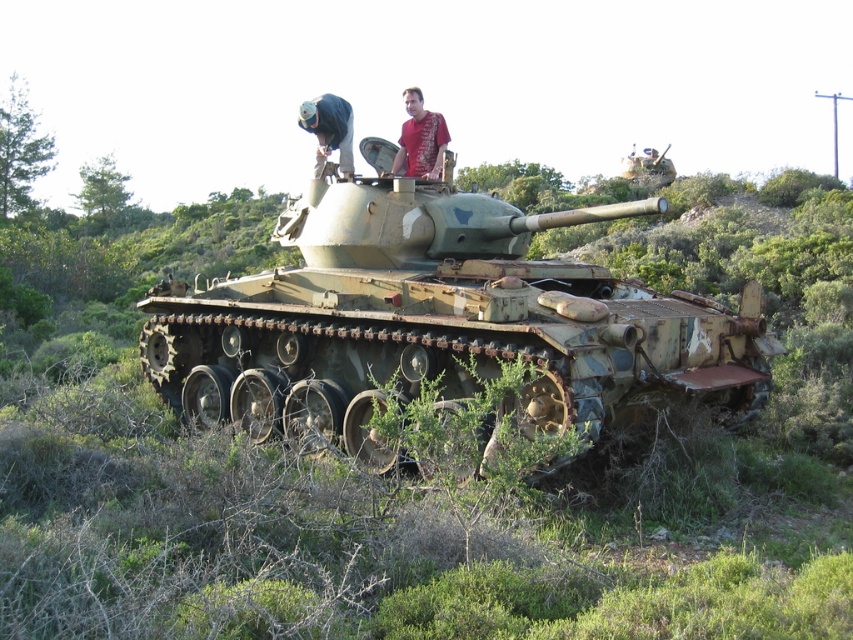
Question: Is rusty metal tank at center above blue fabric hat at upper center?

Choices:
 (A) no
 (B) yes

Answer: (A)

Question: Which of the following is the closest to the observer?

Choices:
 (A) rusty metal tank at center
 (B) blue fabric hat at upper center
 (C) red fabric shirt at upper center

Answer: (A)

Question: Which object is closer to the camera taking this photo?

Choices:
 (A) red fabric shirt at upper center
 (B) rusty metal tank at center

Answer: (B)

Question: Can you confirm if rusty metal tank at center is positioned below red fabric shirt at upper center?

Choices:
 (A) no
 (B) yes

Answer: (B)

Question: Does rusty metal tank at center appear under blue fabric hat at upper center?

Choices:
 (A) yes
 (B) no

Answer: (A)

Question: Which object is farther from the camera taking this photo?

Choices:
 (A) red fabric shirt at upper center
 (B) rusty metal tank at center

Answer: (A)